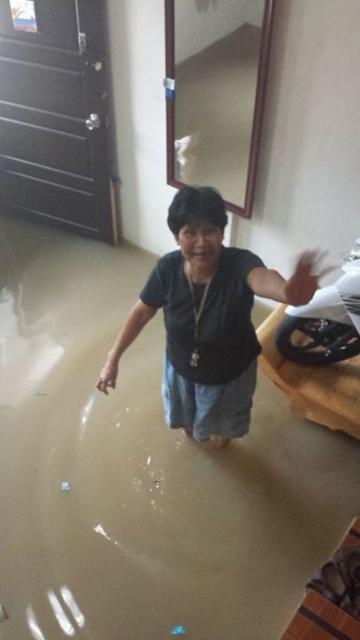
You are a rescue worker trying to reach the woman in the flooded area. You have a 36 inch long pole. Can you safely reach her using the pole from the brown matte water at center to the matte black shirt at center?

The distance between the brown matte water at center and the matte black shirt at center is 36.47 inches. Since the pole is 36 inches long, it is slightly shorter than the required distance. Therefore, the pole may not be long enough to safely reach her.

You are a rescue worker trying to reach the woman in the flooded area. You see the brown matte water at center and the shiny black motorcycle at center. Which object is closer to you?

The brown matte water at center is closer to the viewer than the shiny black motorcycle at center.